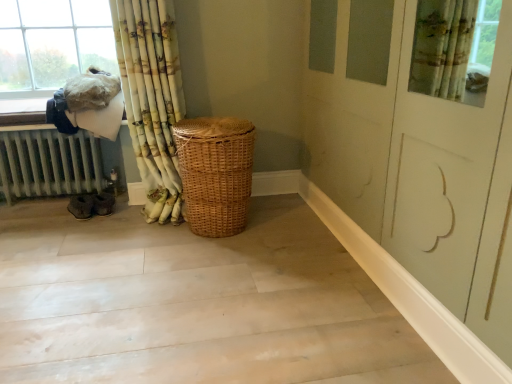
This screenshot has width=512, height=384. Find the location of `vacant area that is in front of bamboo curtain at left`. vacant area that is in front of bamboo curtain at left is located at coordinates coord(138,244).